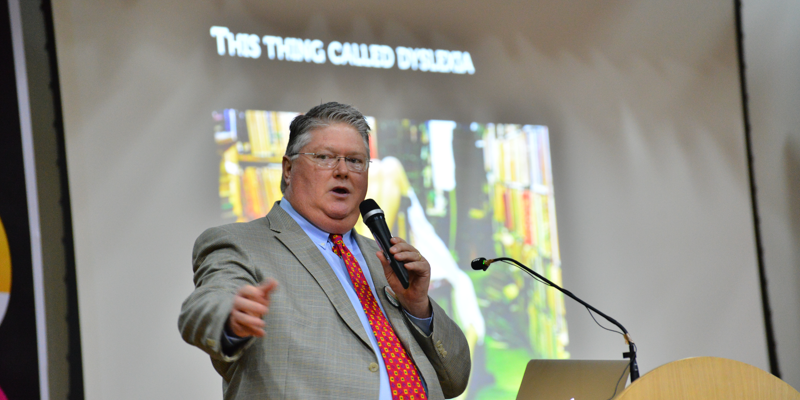
The width and height of the screenshot is (800, 400). What are the coordinates of `brown stand` in the screenshot? It's located at pyautogui.click(x=660, y=385).